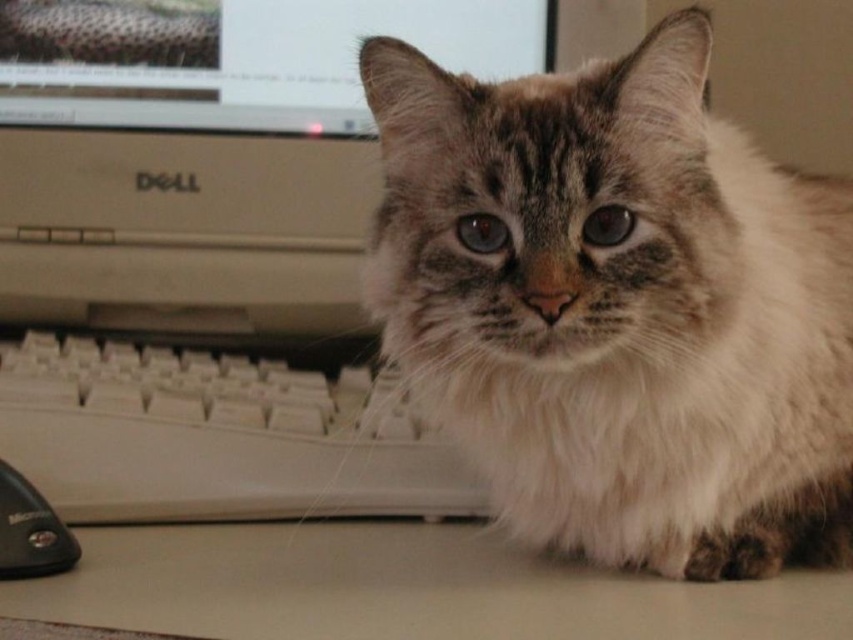
Based on the photo, is white plastic keyboard at lower center to the right of black plastic mouse at lower left from the viewer's perspective?

Indeed, white plastic keyboard at lower center is positioned on the right side of black plastic mouse at lower left.

This screenshot has width=853, height=640. Identify the location of white plastic keyboard at lower center. (215, 436).

Is point (212, 419) less distant than point (44, 572)?

No, (212, 419) is behind (44, 572).

The height and width of the screenshot is (640, 853). I want to click on white plastic keyboard at lower center, so click(x=215, y=436).

The height and width of the screenshot is (640, 853). I want to click on fuzzy fur cat at center, so click(x=619, y=307).

Does fuzzy fur cat at center have a greater width compared to matte plastic monitor at upper center?

No.

Who is more distant from viewer, (490, 115) or (457, 20)?

Point (457, 20)

Identify the location of fuzzy fur cat at center. The width and height of the screenshot is (853, 640). [x=619, y=307].

Does point (177, 378) lie behind point (357, 113)?

No.

Which is below, white plastic keyboard at lower center or matte plastic monitor at upper center?

white plastic keyboard at lower center is below.

This screenshot has height=640, width=853. In order to click on white plastic keyboard at lower center in this screenshot , I will do `click(215, 436)`.